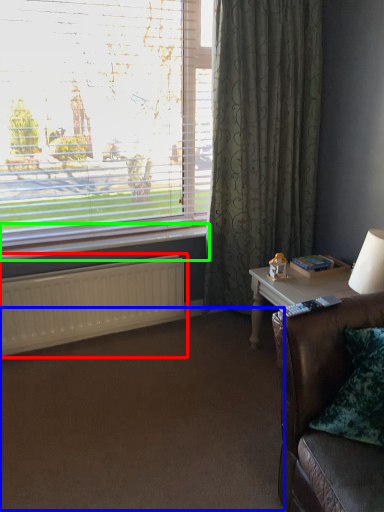
Question: Estimate the real-world distances between objects in this image. Which object is closer to radiator (highlighted by a red box), plain (highlighted by a blue box) or window sill (highlighted by a green box)?

Choices:
 (A) plain
 (B) window sill

Answer: (B)